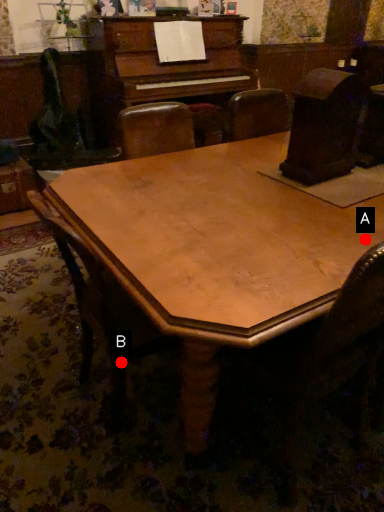
Question: Two points are circled on the image, labeled by A and B beside each circle. Which point is further to the camera?

Choices:
 (A) A is further
 (B) B is further

Answer: (B)